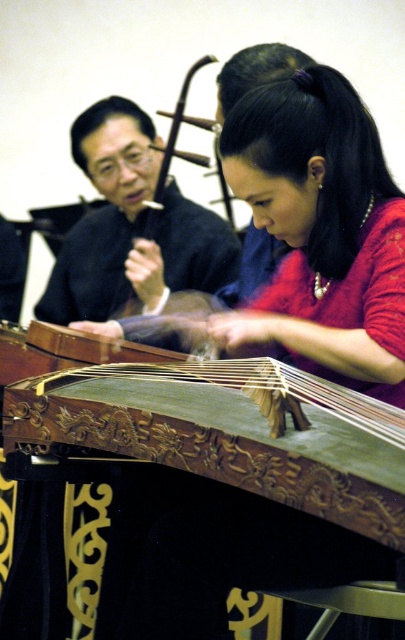
Question: Can you confirm if carved wood zither at center is smaller than matte black robe at upper left?

Choices:
 (A) yes
 (B) no

Answer: (A)

Question: Among these points, which one is nearest to the camera?

Choices:
 (A) (100, 282)
 (B) (373, 445)
 (C) (253, 157)

Answer: (B)

Question: Which object appears farthest from the camera in this image?

Choices:
 (A) carved wood zither at center
 (B) matte black robe at upper left

Answer: (B)

Question: Is matte green wooden instrument at center closer to the viewer compared to matte black robe at upper left?

Choices:
 (A) yes
 (B) no

Answer: (A)

Question: Can you confirm if carved wood zither at center is positioned below matte black robe at upper left?

Choices:
 (A) yes
 (B) no

Answer: (A)

Question: Estimate the real-world distances between objects in this image. Which object is closer to the carved wood zither at center?

Choices:
 (A) matte green wooden instrument at center
 (B) matte black robe at upper left

Answer: (A)